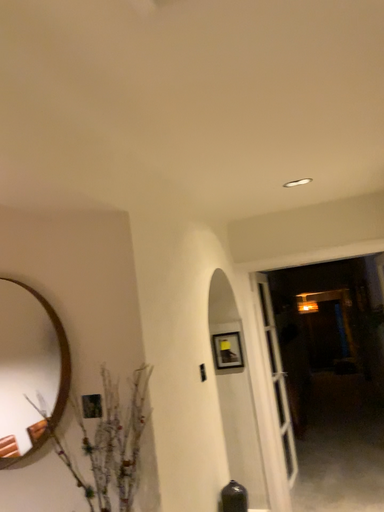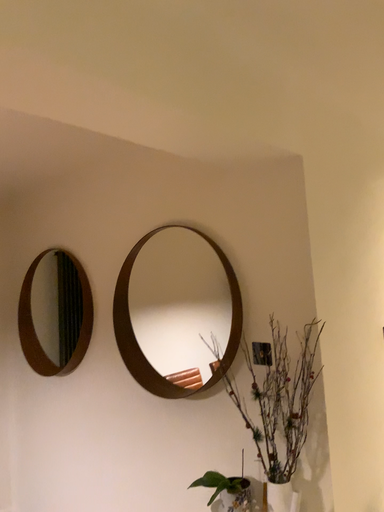
Question: Which way did the camera rotate in the video?

Choices:
 (A) rotated left
 (B) rotated right

Answer: (A)